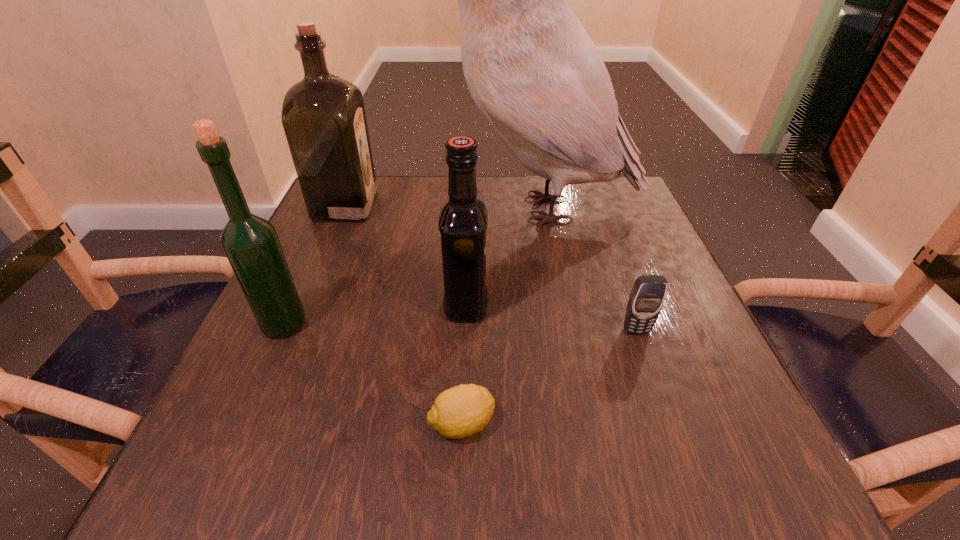
I want to click on object located at the far right corner, so click(x=536, y=76).

Identify the location of vacant space at the far edge of the desktop. (424, 221).

This screenshot has height=540, width=960. In the image, there is a desktop. Identify the location of free space at the near edge. (511, 436).

I want to click on free space at the left edge of the desktop, so click(321, 414).

Identify the location of free space at the right edge. The height and width of the screenshot is (540, 960). (603, 233).

Where is `free space at the near left corner of the desktop`? This screenshot has width=960, height=540. free space at the near left corner of the desktop is located at coordinates (252, 453).

Identify the location of vacant space at the far right corner. (628, 227).

Find the location of a particular element. The image size is (960, 540). vacant area that lies between the cellular telephone and the parakeet is located at coordinates (588, 270).

You are a GUI agent. You are given a task and a screenshot of the screen. Output one action in this format:
    pyautogui.click(x=<x>, y=<y>)
    Task: Click on the vacant point located between the farthest liquor and the lemon
    
    Given the screenshot: What is the action you would take?
    pyautogui.click(x=404, y=314)

Where is `free spot between the second shortest object and the rightmost liquor`? The width and height of the screenshot is (960, 540). free spot between the second shortest object and the rightmost liquor is located at coordinates (551, 318).